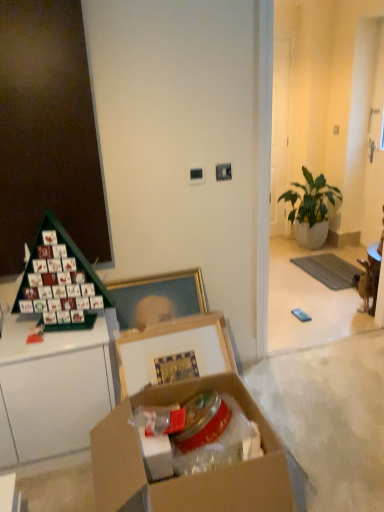
The image size is (384, 512). Identify the location of free space to the right of cardboard box at center. (328, 449).